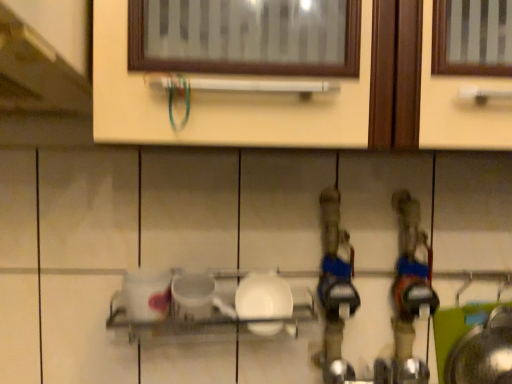
Question: Is white glossy plate at center closer to the viewer compared to white glossy plate at center?

Choices:
 (A) no
 (B) yes

Answer: (A)

Question: Considering the relative sizes of white glossy plate at center and white glossy plate at center in the image provided, is white glossy plate at center shorter than white glossy plate at center?

Choices:
 (A) yes
 (B) no

Answer: (B)

Question: Does white glossy plate at center appear on the right side of white glossy plate at center?

Choices:
 (A) no
 (B) yes

Answer: (B)

Question: Is white glossy plate at center not close to white glossy plate at center?

Choices:
 (A) no
 (B) yes

Answer: (A)

Question: From the image's perspective, is white glossy plate at center over white glossy plate at center?

Choices:
 (A) no
 (B) yes

Answer: (B)

Question: Is white glossy plate at center facing towards white glossy plate at center?

Choices:
 (A) yes
 (B) no

Answer: (A)

Question: Considering the relative positions of white glossy plate at center and white glossy plate at center in the image provided, is white glossy plate at center to the right of white glossy plate at center from the viewer's perspective?

Choices:
 (A) yes
 (B) no

Answer: (B)

Question: From the image's perspective, is white glossy plate at center located above white glossy plate at center?

Choices:
 (A) no
 (B) yes

Answer: (A)

Question: Is white glossy plate at center located outside white glossy plate at center?

Choices:
 (A) no
 (B) yes

Answer: (A)

Question: Is white glossy plate at center smaller than white glossy plate at center?

Choices:
 (A) yes
 (B) no

Answer: (B)

Question: Is white glossy plate at center touching white glossy plate at center?

Choices:
 (A) yes
 (B) no

Answer: (A)

Question: Would you say white glossy plate at center contains white glossy plate at center?

Choices:
 (A) yes
 (B) no

Answer: (A)

Question: Does point (282, 317) appear closer or farther from the camera than point (244, 294)?

Choices:
 (A) closer
 (B) farther

Answer: (B)